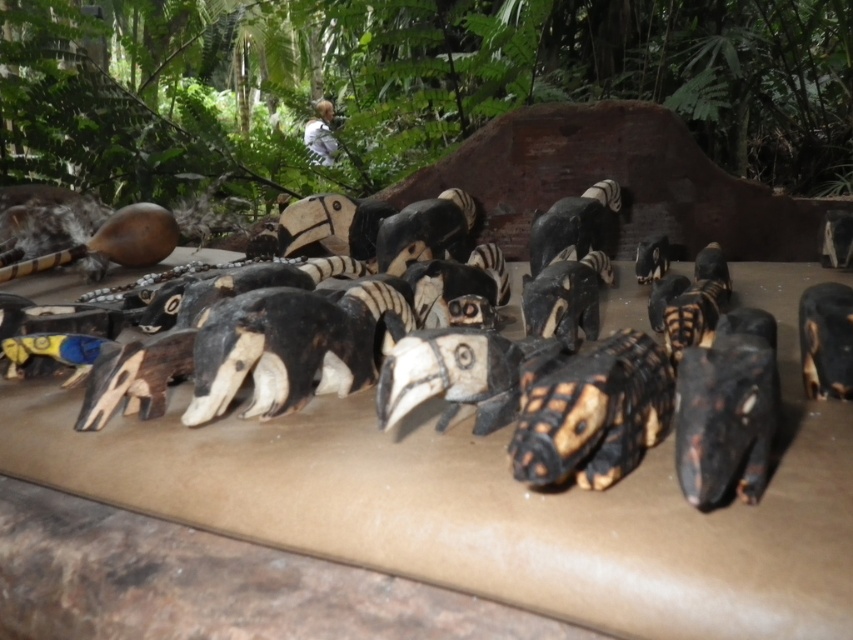
Is black wood animal at center in front of black matte hornbill head at lower right?

Yes.

Who is more distant from viewer, [650,499] or [834,284]?

Point [834,284]

Identify the location of black wood animal at center. The width and height of the screenshot is (853, 640). (444, 477).